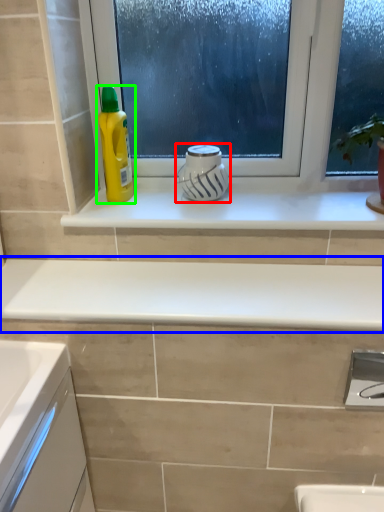
Question: Which object is positioned farthest from appliance (highlighted by a red box)? Select from countertop (highlighted by a blue box) and cleaning product (highlighted by a green box).

Choices:
 (A) countertop
 (B) cleaning product

Answer: (A)